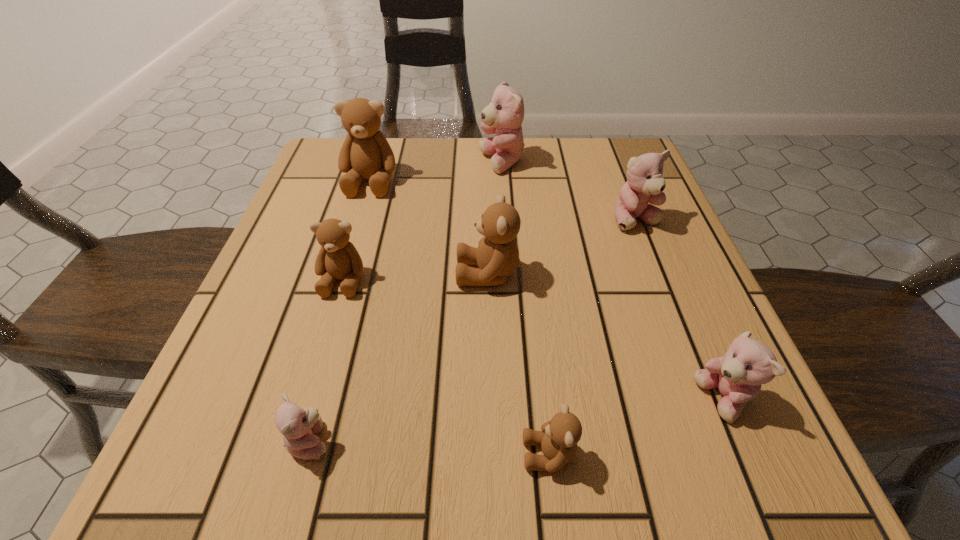
Locate an element on the screen. The width and height of the screenshot is (960, 540). the farthest pink teddy bear is located at coordinates (504, 115).

Find the location of a particular element. This screenshot has height=540, width=960. the third pink teddy bear from right to left is located at coordinates (504, 115).

The height and width of the screenshot is (540, 960). Identify the location of the farthest brown teddy bear. (365, 153).

Locate an element on the screen. the second farthest pink teddy bear is located at coordinates (645, 183).

I want to click on the third farthest object, so click(x=645, y=183).

I want to click on the second biggest brown teddy bear, so click(497, 256).

Image resolution: width=960 pixels, height=540 pixels. Find the location of `the third biggest brown teddy bear`. the third biggest brown teddy bear is located at coordinates (338, 258).

Where is `the third biggest pink teddy bear`? This screenshot has height=540, width=960. the third biggest pink teddy bear is located at coordinates (748, 363).

I want to click on the smallest brown teddy bear, so click(558, 439).

Find the location of a particular element. the smallest pink teddy bear is located at coordinates (299, 426).